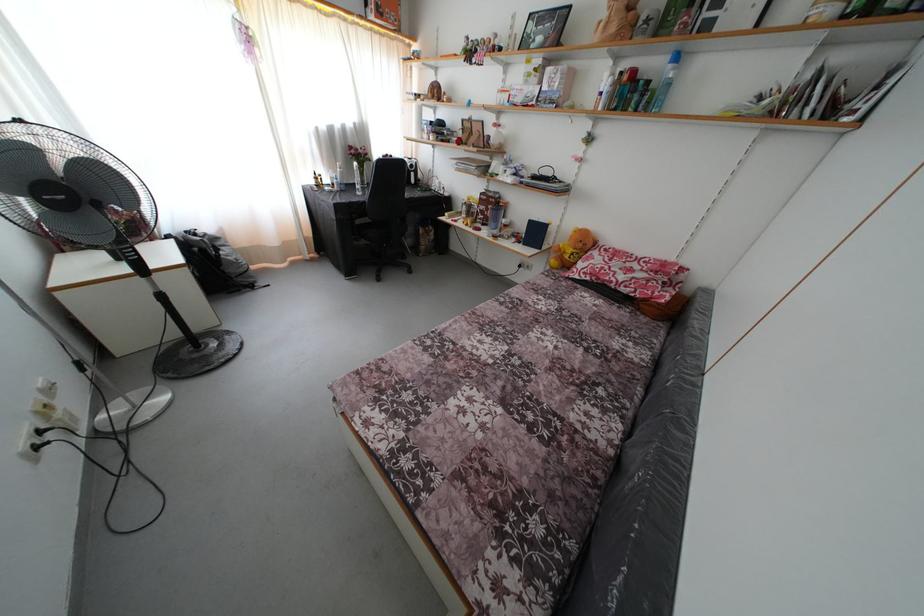
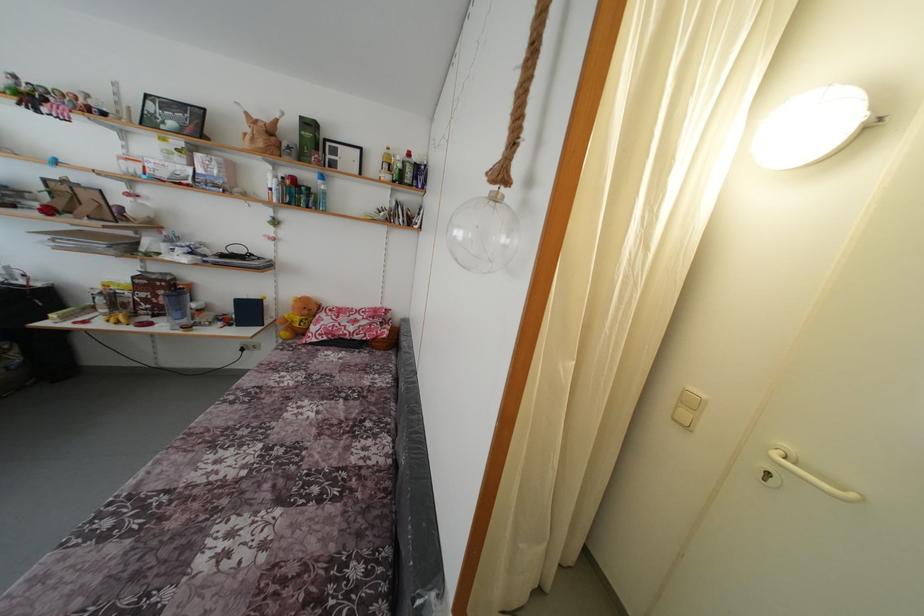
Find the pixel in the second image that matches point 475,219 in the first image.

(120, 310)